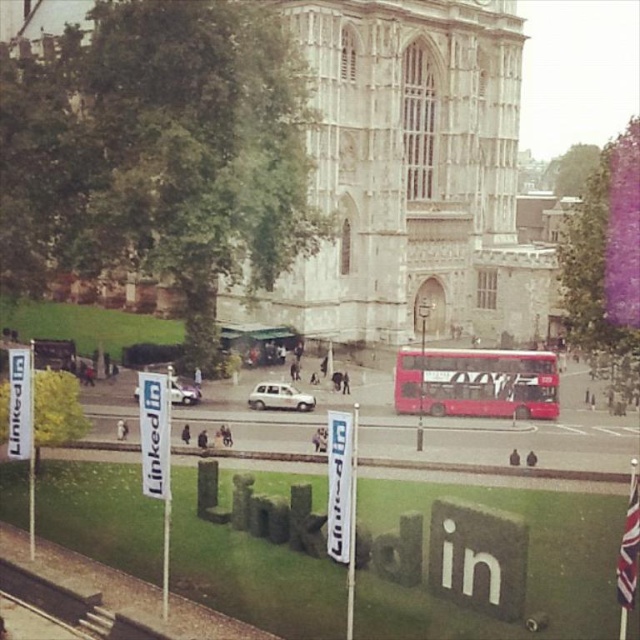
Who is higher up, white matte car at center or silver metallic van at center?

silver metallic van at center is above.

Between point (280, 406) and point (188, 397), which one is positioned in front?

Point (280, 406) is more forward.

Find the location of a particular element. This screenshot has height=640, width=640. white matte car at center is located at coordinates (280, 397).

The height and width of the screenshot is (640, 640). I want to click on red matte double-decker bus at center, so click(476, 381).

Does red matte double-decker bus at center appear on the right side of silver metallic van at center?

Indeed, red matte double-decker bus at center is positioned on the right side of silver metallic van at center.

This screenshot has width=640, height=640. What do you see at coordinates (476, 381) in the screenshot?
I see `red matte double-decker bus at center` at bounding box center [476, 381].

The image size is (640, 640). I want to click on red matte double-decker bus at center, so click(x=476, y=381).

Does red matte double-decker bus at center appear over white matte car at center?

Yes, red matte double-decker bus at center is above white matte car at center.

Find the location of `red matte double-decker bus at center`. red matte double-decker bus at center is located at coordinates (476, 381).

Identify the location of red matte double-decker bus at center. The image size is (640, 640). (476, 381).